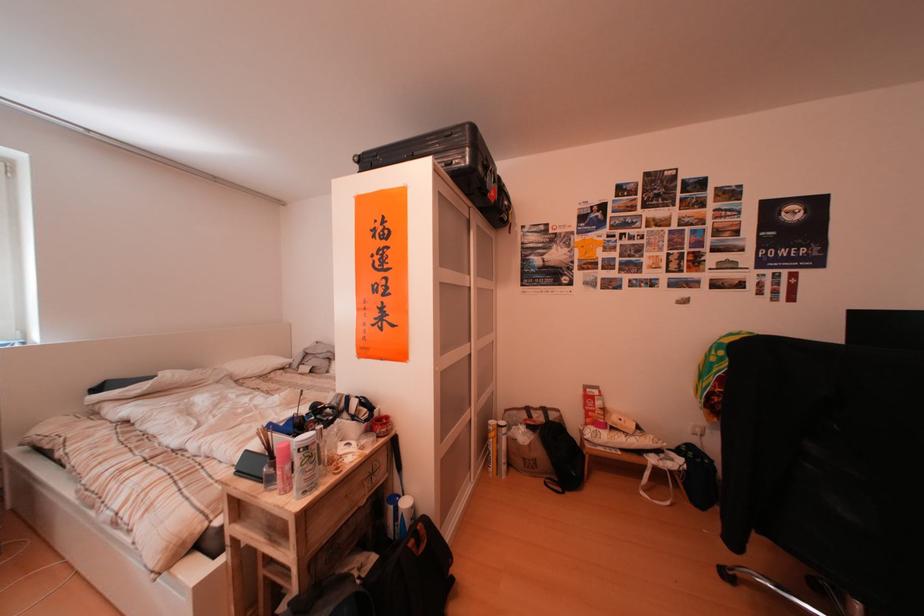
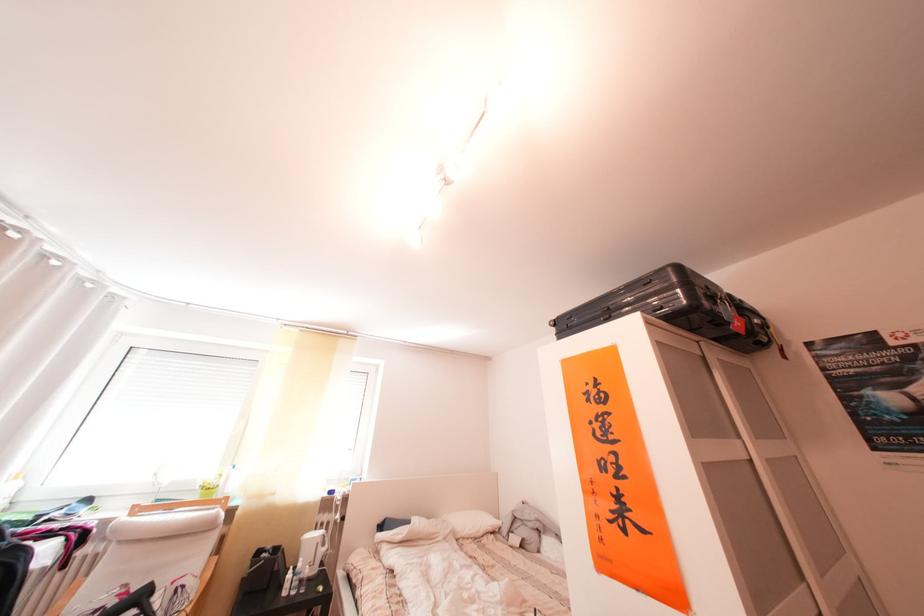
In the second image, find the point that corresponds to point (480, 200) in the first image.

(703, 336)